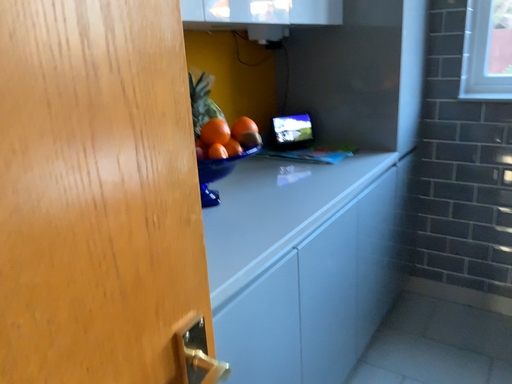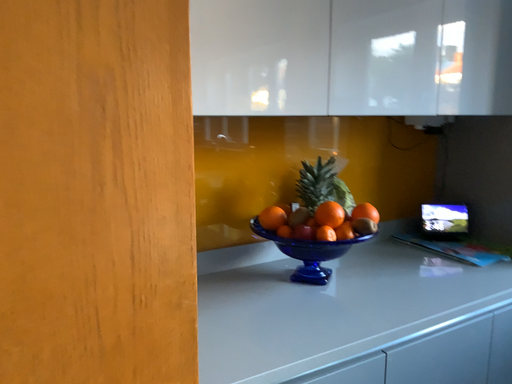
Question: Which way did the camera rotate in the video?

Choices:
 (A) rotated downward
 (B) rotated upward

Answer: (B)